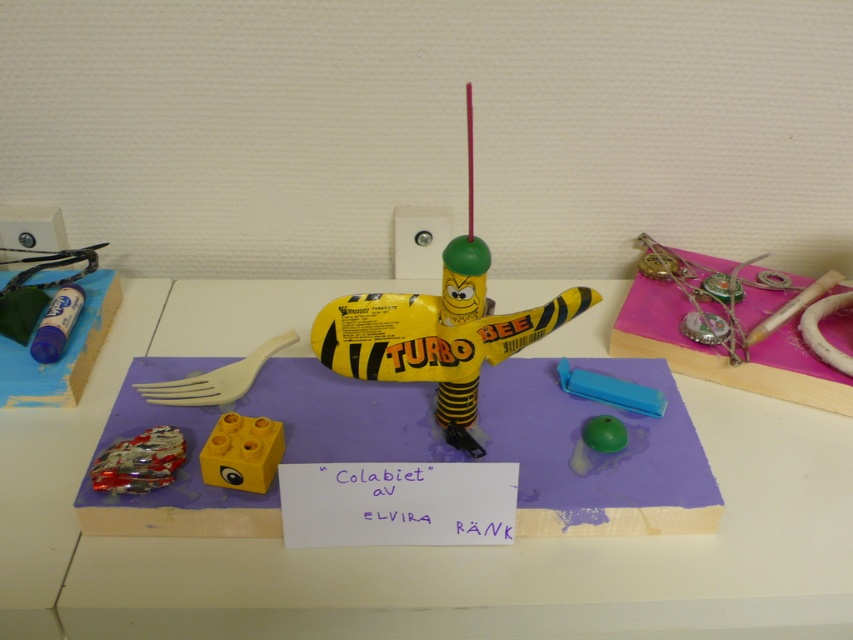
Question: Which of the following is the closest to the observer?

Choices:
 (A) blue plastic eraser at center
 (B) shiny metallic car at lower left

Answer: (B)

Question: Considering the relative positions of purple foam board at center and yellow plastic block at center in the image provided, where is purple foam board at center located with respect to yellow plastic block at center?

Choices:
 (A) right
 (B) left

Answer: (A)

Question: Does yellow matte plastic bee at center appear over blue plastic eraser at center?

Choices:
 (A) no
 (B) yes

Answer: (B)

Question: Which is farther from the yellow matte plastic bee at center?

Choices:
 (A) green rubber ball at center
 (B) blue plastic eraser at center

Answer: (B)

Question: Observing the image, what is the correct spatial positioning of yellow plastic block at center in reference to green rubber ball at center?

Choices:
 (A) below
 (B) above

Answer: (A)

Question: Which point is closer to the camera?

Choices:
 (A) shiny metallic car at lower left
 (B) yellow matte plastic bee at center
 (C) blue plastic eraser at center

Answer: (B)